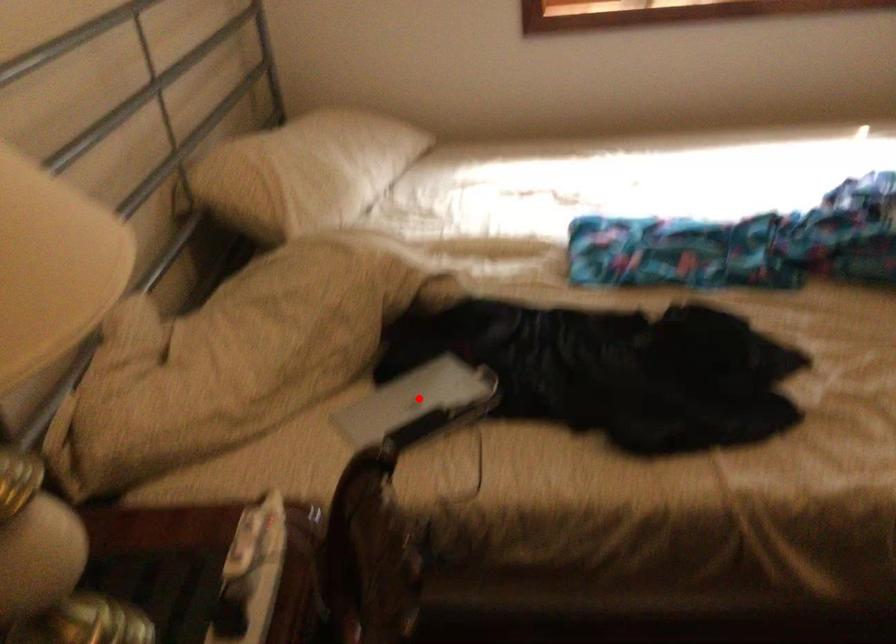
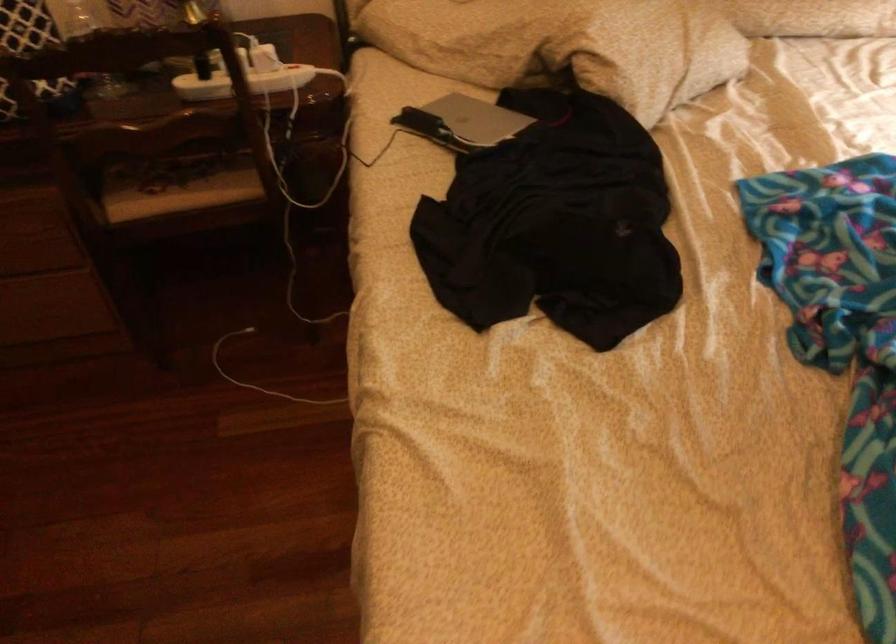
Question: A red point is marked in image1. In image2, is the corresponding 3D point closer to the camera or farther? Reply with the corresponding letter.

Choices:
 (A) The corresponding 3D point is closer.
 (B) The corresponding 3D point is farther.

Answer: (B)